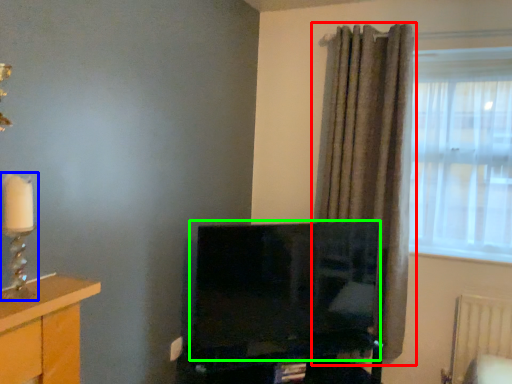
Question: Which object is positioned farthest from curtain (highlighted by a red box)? Select from candle holder (highlighted by a blue box) and television (highlighted by a green box).

Choices:
 (A) candle holder
 (B) television

Answer: (A)